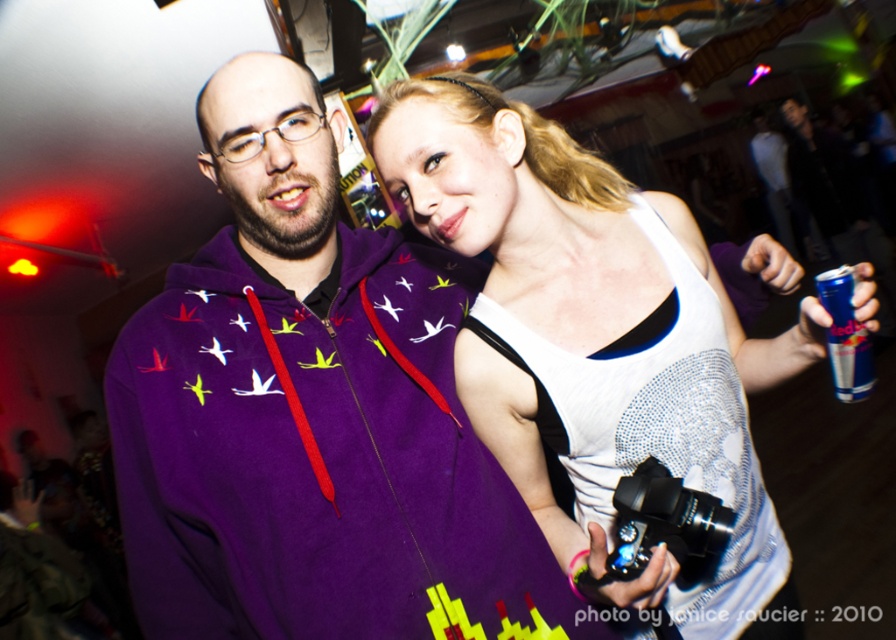
In the scene shown: How much distance is there between purple fleece hoodie at center and black metallic camera at center?

They are 17.50 inches apart.

Which is behind, point (428, 268) or point (687, 564)?

The point (428, 268) is more distant.

You are a GUI agent. You are given a task and a screenshot of the screen. Output one action in this format:
    pyautogui.click(x=<x>, y=<y>)
    Task: Click on the purple fleece hoodie at center
    The height and width of the screenshot is (640, 896).
    Given the screenshot: What is the action you would take?
    pyautogui.click(x=312, y=416)

Between white sparkly tank top at upper center and black metallic camera at center, which one has more height?

white sparkly tank top at upper center

Which is more to the left, white sparkly tank top at upper center or black metallic camera at center?

Positioned to the left is black metallic camera at center.

Image resolution: width=896 pixels, height=640 pixels. Describe the element at coordinates (596, 339) in the screenshot. I see `white sparkly tank top at upper center` at that location.

I want to click on white sparkly tank top at upper center, so click(596, 339).

Between black metallic camera at center and red bull can at upper right, which one is positioned lower?

black metallic camera at center is below.

Does black metallic camera at center come in front of red bull can at upper right?

No.

Does point (670, 508) come behind point (829, 289)?

Yes, point (670, 508) is farther from viewer.

Locate an element on the screen. This screenshot has height=640, width=896. black metallic camera at center is located at coordinates (665, 524).